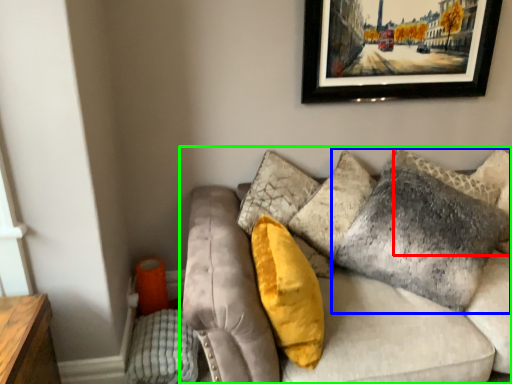
Question: Considering the real-world distances, which object is closest to pillow (highlighted by a red box)? pillow (highlighted by a blue box) or studio couch (highlighted by a green box).

Choices:
 (A) pillow
 (B) studio couch

Answer: (A)